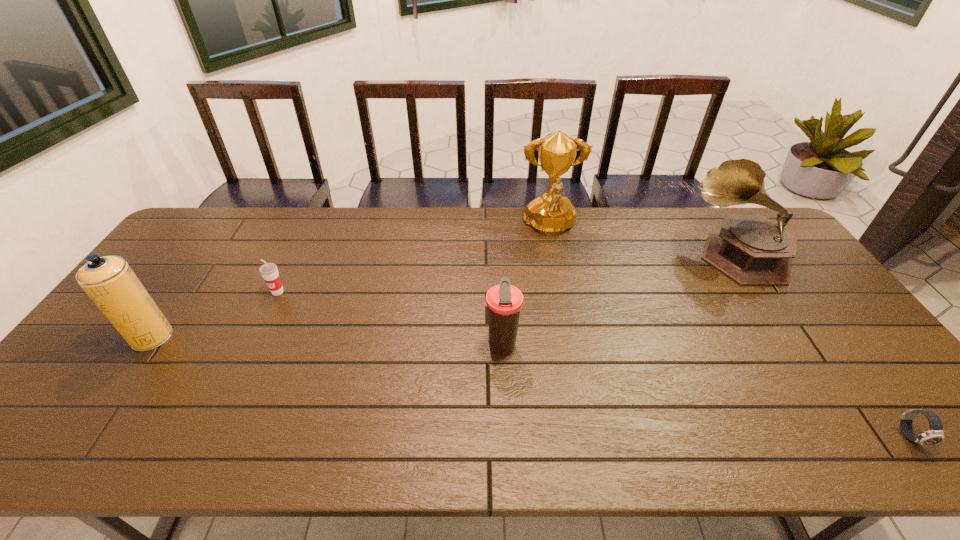
In order to click on phonograph record located in the right edge section of the desktop in this screenshot , I will do `click(750, 249)`.

The width and height of the screenshot is (960, 540). I want to click on watch positioned at the right edge, so click(x=934, y=435).

At what (x,y) coordinates should I click in order to perform the action: click on object positioned at the far right corner. Please return your answer as a coordinate pair (x, y). Looking at the image, I should click on (750, 249).

Locate an element on the screen. The width and height of the screenshot is (960, 540). object situated at the near right corner is located at coordinates (x=934, y=435).

This screenshot has width=960, height=540. What are the coordinates of `vacant position at the far edge of the desktop` in the screenshot? It's located at (270, 210).

This screenshot has width=960, height=540. I want to click on free space at the near edge, so click(528, 429).

This screenshot has height=540, width=960. In order to click on vacant space at the right edge in this screenshot , I will do 776,295.

You are a GUI agent. You are given a task and a screenshot of the screen. Output one action in this format:
    pyautogui.click(x=<x>, y=<y>)
    Task: Click on the empty space that is in between the fourth object from left to right and the fourth tallest object
    
    Given the screenshot: What is the action you would take?
    pyautogui.click(x=525, y=287)

Locate an element on the screen. This screenshot has width=960, height=540. vacant space in between the fourth object from left to right and the watch is located at coordinates (730, 332).

In order to click on empty space between the fourth tallest object and the phonograph record in this screenshot , I will do `click(619, 300)`.